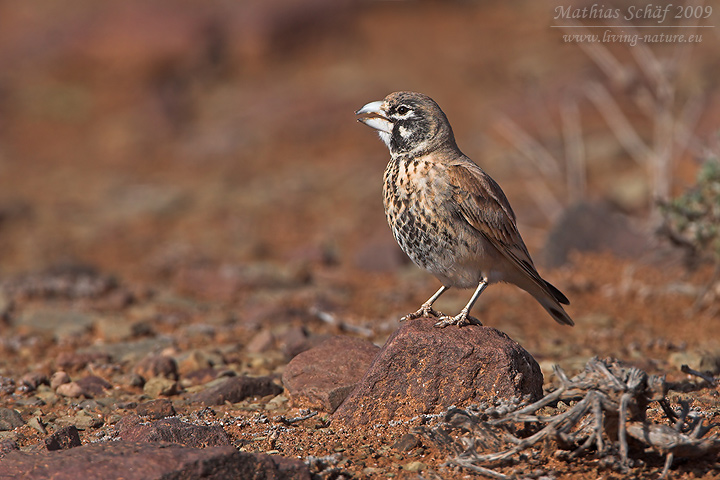
This screenshot has width=720, height=480. In order to click on green plant in this screenshot , I will do `click(697, 220)`.